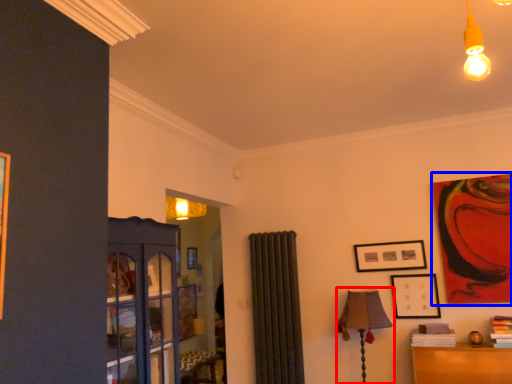
Question: Which object appears closest to the camera in this image, table lamp (highlighted by a red box) or picture frame (highlighted by a blue box)?

Choices:
 (A) table lamp
 (B) picture frame

Answer: (A)